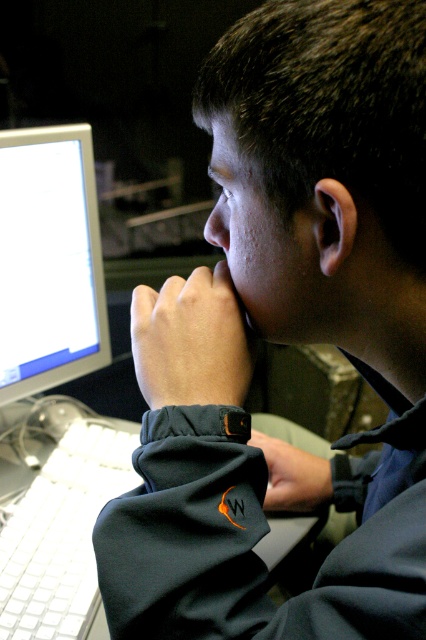
Is skinny white hand at center to the right of black fabric hand at lower center from the viewer's perspective?

Incorrect, skinny white hand at center is not on the right side of black fabric hand at lower center.

Who is more forward, (144, 300) or (282, 445)?

Point (144, 300)

Is point (219, 314) more distant than point (313, 493)?

That is False.

Image resolution: width=426 pixels, height=640 pixels. What are the coordinates of `skinny white hand at center` in the screenshot? It's located at (190, 340).

Who is positioned more to the right, white plastic keyboard at lower left or skinny white hand at center?

From the viewer's perspective, skinny white hand at center appears more on the right side.

In the scene shown: Who is more forward, (x=118, y=451) or (x=241, y=339)?

Point (x=241, y=339) is more forward.

What are the coordinates of `white plastic keyboard at lower left` in the screenshot? It's located at (62, 532).

Consider the image. Can you confirm if matte silver monitor at left is smaller than skinny white hand at center?

Actually, matte silver monitor at left might be larger than skinny white hand at center.

Is matte silver monitor at left further to the viewer compared to skinny white hand at center?

Yes, it is behind skinny white hand at center.

Measure the distance between point (80, 310) and camera.

The distance of point (80, 310) from camera is 3.59 feet.

The height and width of the screenshot is (640, 426). In order to click on matte silver monitor at left in this screenshot , I will do `click(48, 260)`.